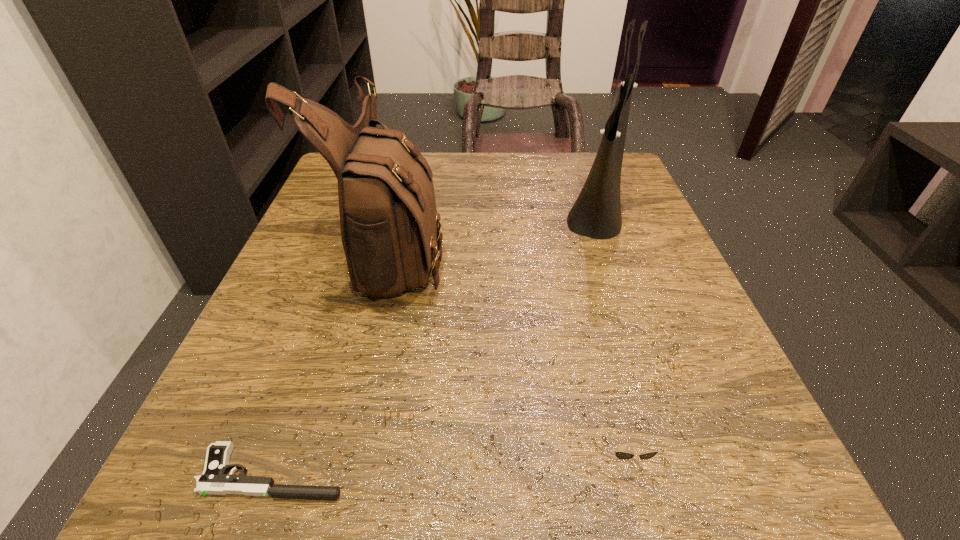
In order to click on the right shoulder bag in this screenshot , I will do `click(596, 213)`.

I want to click on the left shoulder bag, so click(389, 222).

Identify the location of the second shortest object. Image resolution: width=960 pixels, height=540 pixels. (623, 455).

Where is `pistol`? Image resolution: width=960 pixels, height=540 pixels. pistol is located at coordinates (214, 480).

Identify the location of vacant space situated on the left of the right shoulder bag. [x=377, y=207].

What are the coordinates of `vacant space located 0.300m on the front-facing side of the left shoulder bag` in the screenshot? It's located at (607, 251).

This screenshot has width=960, height=540. In order to click on object that is at the far edge in this screenshot , I will do `click(596, 213)`.

Locate an element on the screen. sunglasses that is at the near edge is located at coordinates (623, 455).

What are the coordinates of `pistol positioned at the near edge` in the screenshot? It's located at (214, 480).

Where is `shoulder bag that is at the left edge`? shoulder bag that is at the left edge is located at coordinates (389, 222).